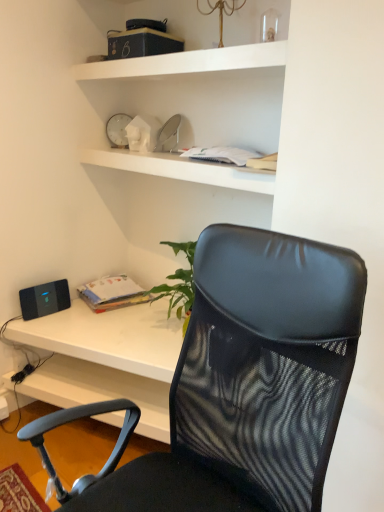
Question: From a real-world perspective, is white matte shelf at upper center positioned above or below matte paper book at center?

Choices:
 (A) below
 (B) above

Answer: (B)

Question: Does point (284, 59) appear closer or farther from the camera than point (79, 288)?

Choices:
 (A) closer
 (B) farther

Answer: (A)

Question: Considering the real-world distances, which object is closest to the matte paper book at center?

Choices:
 (A) white plastic clock at upper center
 (B) black mesh chair at center
 (C) white matte shelf at upper center
 (D) black matte speaker at lower left

Answer: (D)

Question: Estimate the real-world distances between objects in this image. Which object is farther from the black mesh chair at center?

Choices:
 (A) black matte speaker at lower left
 (B) white matte shelf at upper center
 (C) white plastic clock at upper center
 (D) matte paper book at center

Answer: (C)